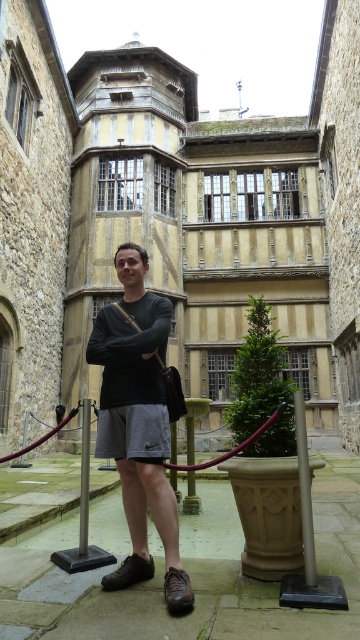
You are a photographer setting up for a portrait shoot in this courtyard. You have a black sweater at center and a brown polished pole at center in the scene. Which object should you focus on if you want to capture the larger item in your frame?

The black sweater at center is bigger than the brown polished pole at center, so you should focus on the black sweater at center to capture the larger item in your frame.

You are a photographer setting up a shot in the courtyard. You notice the black sweater at center and the brown polished pole at center. Which object is closer to the camera?

The black sweater at center is closer to the camera than the brown polished pole at center.